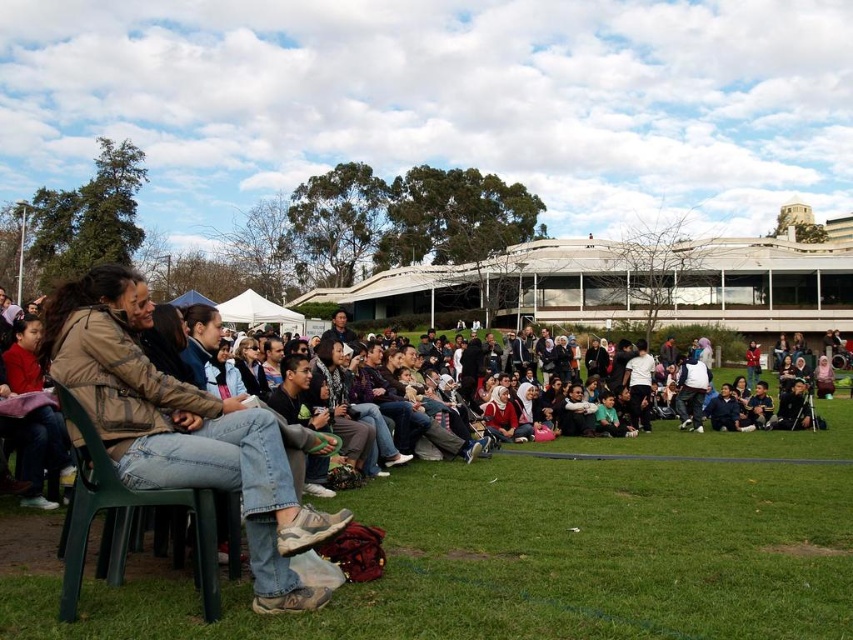
Who is more distant from viewer, (602, 545) or (190, 417)?

The point (602, 545) is more distant.

Looking at this image, can you confirm if green grass at lower left is positioned below denim jeans at left?

Yes.

Which is behind, point (831, 621) or point (228, 451)?

The point (228, 451) is behind.

Identify the location of green grass at lower left. (554, 552).

Is green grass at lower left thinner than green plastic chair at lower left?

No.

Looking at this image, which of these two, green grass at lower left or green plastic chair at lower left, stands shorter?

Standing shorter between the two is green plastic chair at lower left.

Does point (560, 637) come closer to viewer compared to point (115, 484)?

Yes, point (560, 637) is closer to viewer.

Locate an element on the screen. green grass at lower left is located at coordinates (554, 552).

Who is shorter, denim jeans at left or green plastic chair at lower left?

green plastic chair at lower left

The image size is (853, 640). What do you see at coordinates (183, 429) in the screenshot? I see `denim jeans at left` at bounding box center [183, 429].

Image resolution: width=853 pixels, height=640 pixels. In order to click on denim jeans at left in this screenshot , I will do `click(183, 429)`.